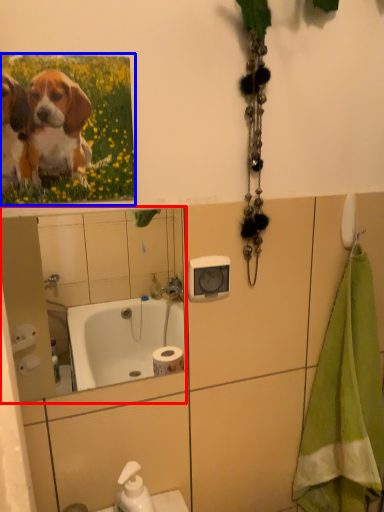
Question: Which point is further to the camera, mirror (highlighted by a red box) or flower (highlighted by a blue box)?

Choices:
 (A) mirror
 (B) flower

Answer: (A)